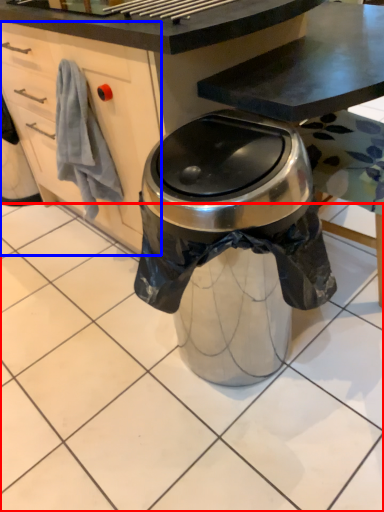
Question: Which of the following is the farthest to the observer, tile (highlighted by a red box) or cabinetry (highlighted by a blue box)?

Choices:
 (A) tile
 (B) cabinetry

Answer: (B)